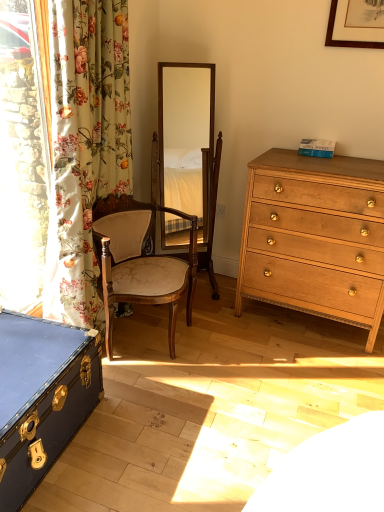
Where is `vacant area situated below wooden upholstered chair at center (from a real-world perspective)`? vacant area situated below wooden upholstered chair at center (from a real-world perspective) is located at coordinates (156, 336).